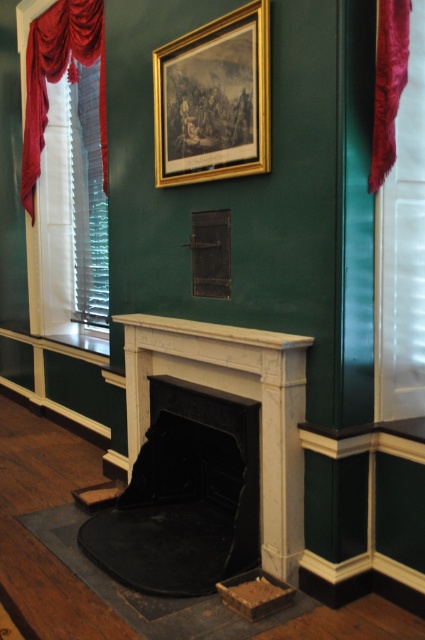
Does black marble fireplace at center appear over gold/gilded picture frame at upper center?

Actually, black marble fireplace at center is below gold/gilded picture frame at upper center.

Does black marble fireplace at center have a greater height compared to gold/gilded picture frame at upper center?

Yes.

Which is behind, point (229, 458) or point (229, 116)?

The point (229, 458) is behind.

The image size is (425, 640). Find the location of `black marble fireplace at center`. black marble fireplace at center is located at coordinates (184, 496).

Is point (269, 52) farther from camera compared to point (22, 154)?

That is False.

Between gold/gilded picture frame at upper center and velvet drapery at left, which one is positioned lower?

Positioned lower is gold/gilded picture frame at upper center.

Is point (217, 54) positioned before point (81, 32)?

Yes, point (217, 54) is closer to viewer.

You are a GUI agent. You are given a task and a screenshot of the screen. Output one action in this format:
    pyautogui.click(x=<x>, y=<y>)
    Task: Click on the gold/gilded picture frame at upper center
    
    Given the screenshot: What is the action you would take?
    pyautogui.click(x=214, y=99)

Can you confirm if black marble fireplace at center is positioned above velvet drapery at left?

No.

Which is above, black marble fireplace at center or velvet drapery at left?

velvet drapery at left is above.

Between point (158, 525) and point (62, 1), which one is positioned behind?

Positioned behind is point (62, 1).

You are a GUI agent. You are given a task and a screenshot of the screen. Output one action in this format:
    pyautogui.click(x=<x>, y=<y>)
    Task: Click on the black marble fireplace at center
    
    Given the screenshot: What is the action you would take?
    pyautogui.click(x=184, y=496)